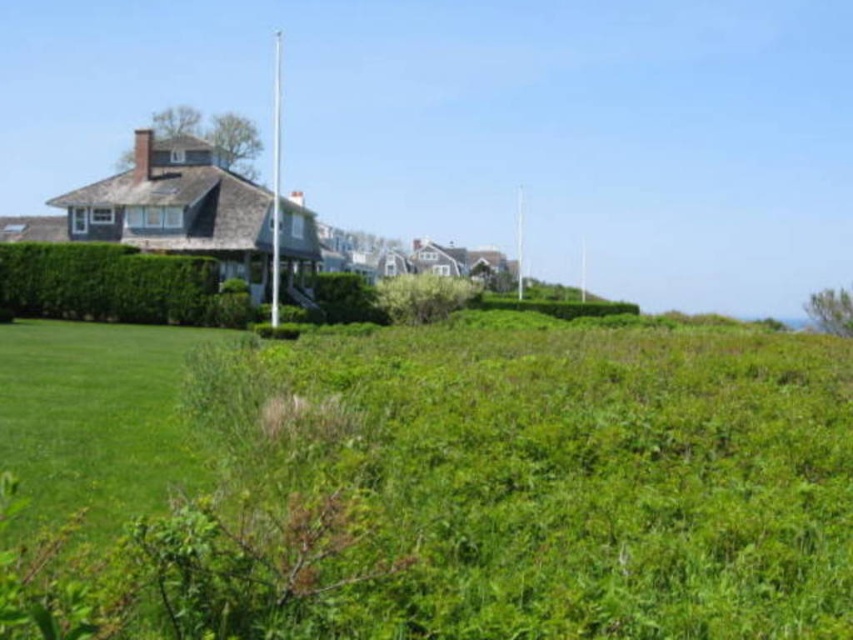
You are a gardener planning to plant a new flower bed between the green leafy grass at center and the metallic flag pole at center. Based on their positions, which side of the flag pole should you place the flowers to ensure they are aligned with the grass?

The green leafy grass at center is to the right of the metallic flag pole at center, so you should plant the flowers to the right side of the flag pole to align them with the grass.

You are a gardener planning to plant a new flower bed between the green leafy grass at center and the white metallic flag pole at center. Based on their positions, which object should you start digging near to ensure the flower bed is between them?

The green leafy grass at center is below the white metallic flag pole at center, so you should start digging near the green leafy grass at center to place the flower bed between them.